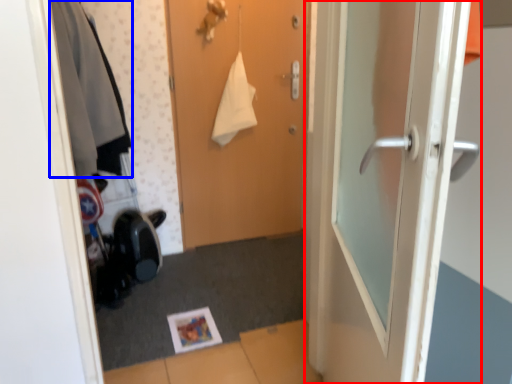
Question: Which point is closer to the camera, door (highlighted by a red box) or clothing (highlighted by a blue box)?

Choices:
 (A) door
 (B) clothing

Answer: (A)